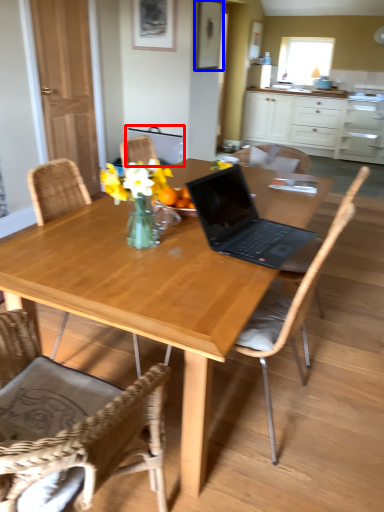
Question: Which point is closer to the camera, armchair (highlighted by a red box) or picture frame (highlighted by a blue box)?

Choices:
 (A) armchair
 (B) picture frame

Answer: (B)